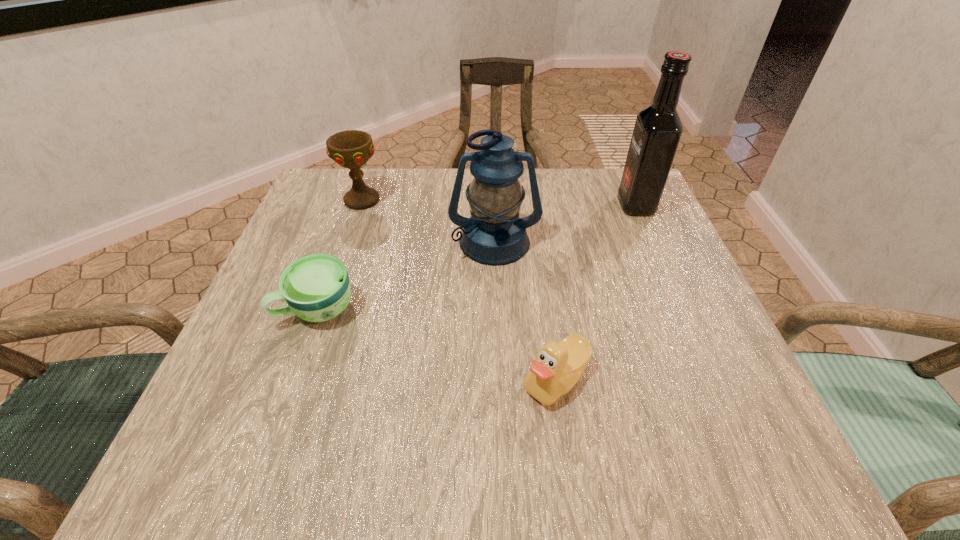
At what (x,y) coordinates should I click in order to perform the action: click on chalice that is positioned at the far edge. Please return your answer as a coordinate pair (x, y). This screenshot has width=960, height=540. Looking at the image, I should click on (351, 149).

The width and height of the screenshot is (960, 540). Find the location of `chalice that is at the left edge`. chalice that is at the left edge is located at coordinates (351, 149).

You are a GUI agent. You are given a task and a screenshot of the screen. Output one action in this format:
    pyautogui.click(x=<x>, y=<y>)
    Task: Click on the cup situated at the left edge
    The image size is (960, 540).
    Given the screenshot: What is the action you would take?
    pyautogui.click(x=316, y=288)

Where is `object present at the right edge`? object present at the right edge is located at coordinates (658, 128).

Where is `object that is at the far left corner`? Image resolution: width=960 pixels, height=540 pixels. object that is at the far left corner is located at coordinates (351, 149).

Locate an element on the screen. The image size is (960, 540). object located in the far right corner section of the desktop is located at coordinates (658, 128).

Identify the location of vacant area at the far edge. The width and height of the screenshot is (960, 540). (449, 219).

You are a GUI agent. You are given a task and a screenshot of the screen. Output one action in this format:
    pyautogui.click(x=<x>, y=<y>)
    Task: Click on the vacant space at the near edge of the desktop
    
    Given the screenshot: What is the action you would take?
    pyautogui.click(x=415, y=422)

The image size is (960, 540). I want to click on free point at the left edge, so click(263, 369).

Locate an element on the screen. vacant region at the right edge of the desktop is located at coordinates (x=624, y=322).